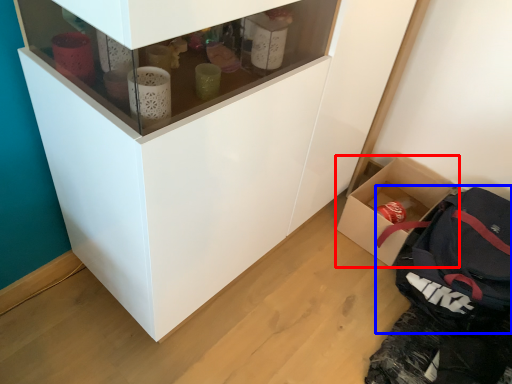
Question: Which of the following is the closest to the observer, box (highlighted by a red box) or backpack (highlighted by a blue box)?

Choices:
 (A) box
 (B) backpack

Answer: (B)